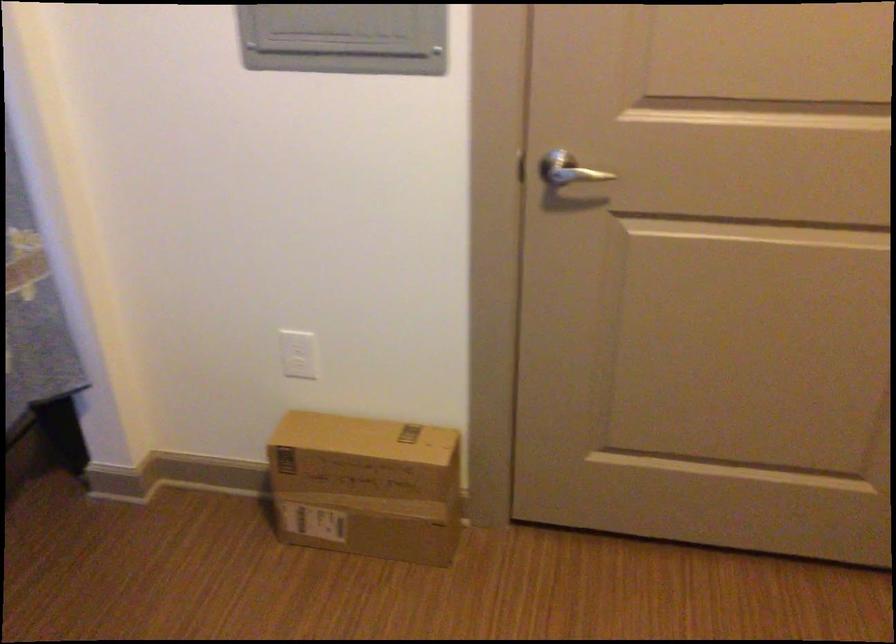
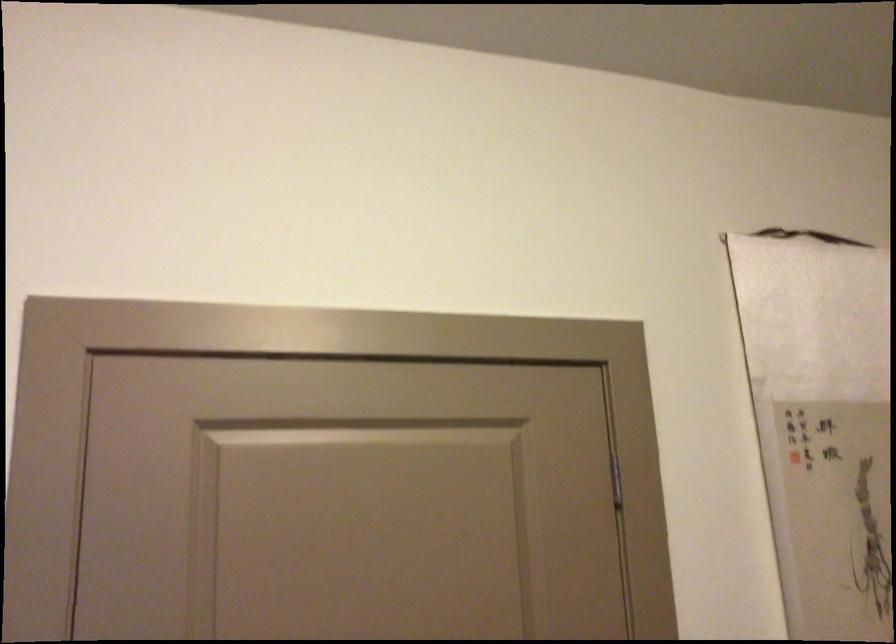
Based on the continuous images, in which direction is the camera rotating?

The rotation direction of the camera is right-up.